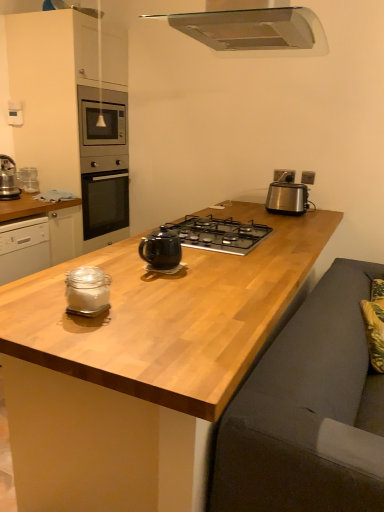
Locate an element on the screen. The width and height of the screenshot is (384, 512). vacant space in front of clear glass jar at center is located at coordinates (81, 334).